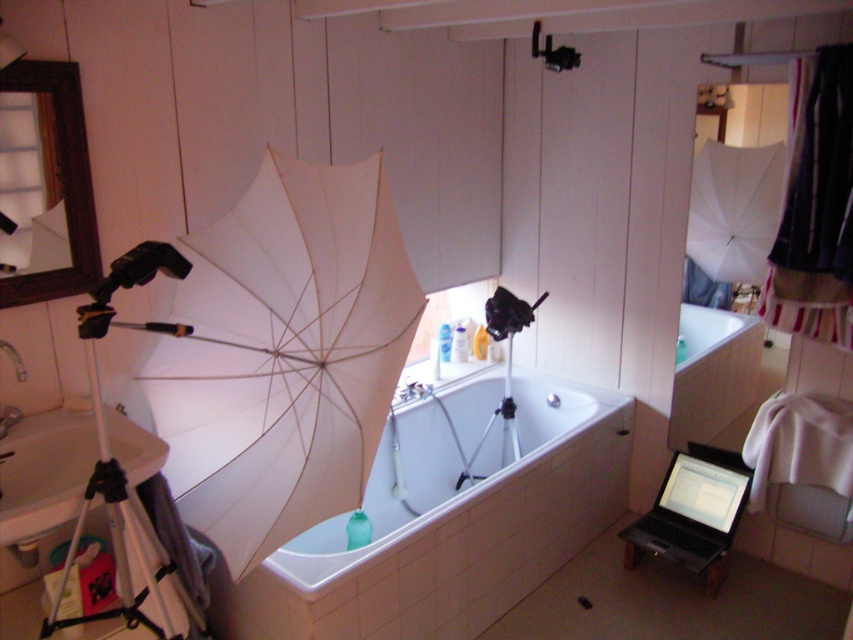
You are a photographer adjusting the lighting setup in the bathroom. You notice two points marked on your camera screen at coordinates point (163, 564) and point (674, 524). Which point is nearer to the camera lens?

Point (163, 564) is closer to the camera than point (674, 524).

You are standing in the bathroom and want to reach both points marked in the scene. Which point, point (233, 564) or point (727, 472), is closer to you?

Point (233, 564) is closer to the viewer than point (727, 472).